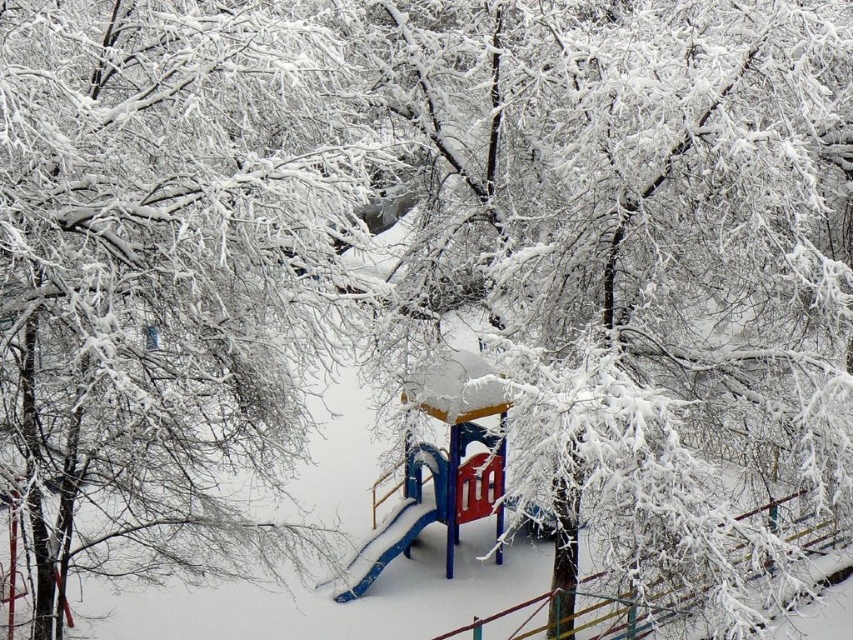
You are standing at the playground in the winter scene and want to walk from the slide to the climbing frame. The slide is located at point [349,83] and the climbing frame is at point [334,582]. Which point will you reach first as you walk towards them?

You will reach point [349,83] first because it is closer to you than point [334,582].